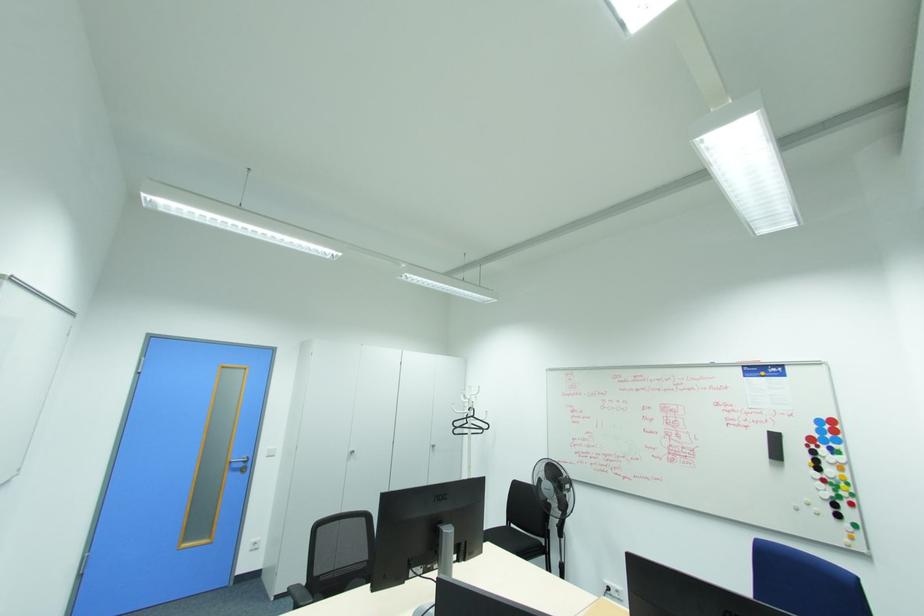
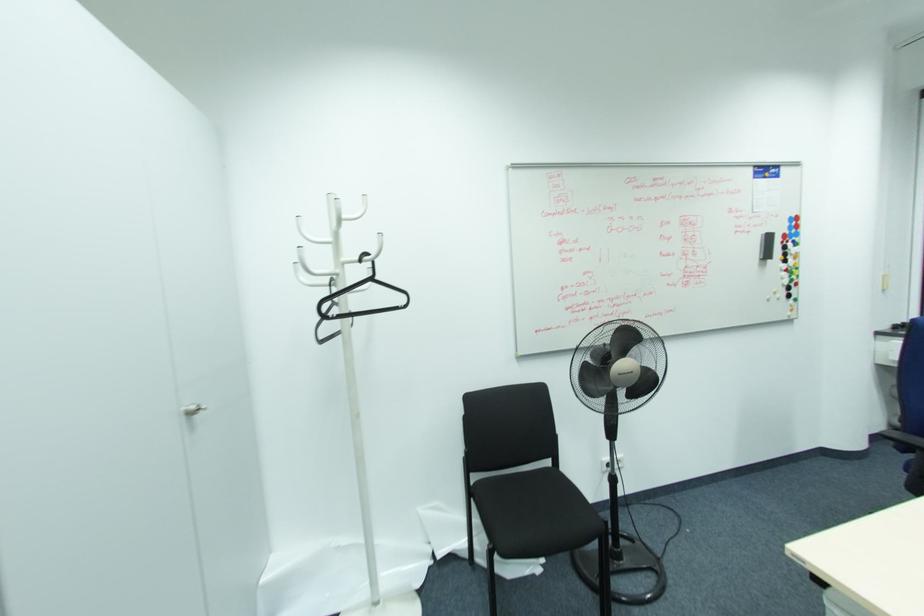
Locate, in the second image, the point that corresponds to the point at 777,456 in the first image.

(768, 256)